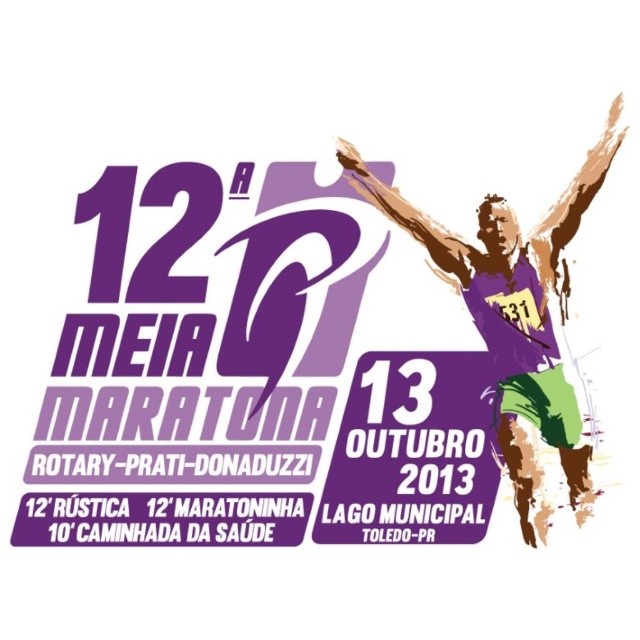
Question: Does purple matte jersey at upper right lie in front of purple paper at center?

Choices:
 (A) yes
 (B) no

Answer: (A)

Question: Among these objects, which one is nearest to the camera?

Choices:
 (A) purple matte jersey at upper right
 (B) purple paper at center

Answer: (A)

Question: Which point appears farthest from the camera in this image?

Choices:
 (A) (506, 326)
 (B) (392, 369)

Answer: (B)

Question: Does purple matte jersey at upper right have a greater width compared to purple paper at center?

Choices:
 (A) yes
 (B) no

Answer: (A)

Question: Can you confirm if purple matte jersey at upper right is positioned above purple paper at center?

Choices:
 (A) no
 (B) yes

Answer: (B)